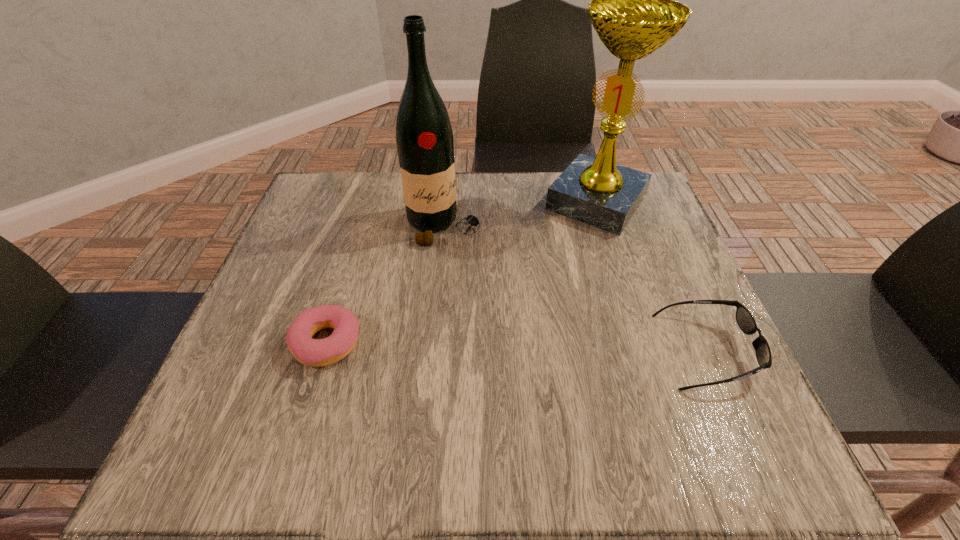
What are the coordinates of `free location that satisfies the following two spatial constraints: 1. on the back side of the third object from right to left; 2. on the right side of the award` in the screenshot? It's located at (445, 202).